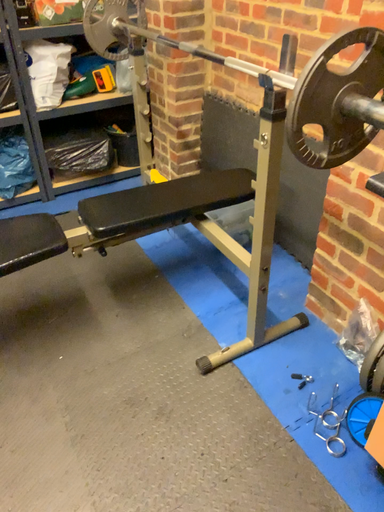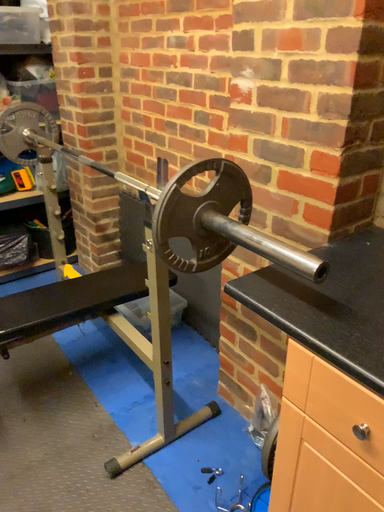
Question: How did the camera likely rotate when shooting the video?

Choices:
 (A) rotated left
 (B) rotated right

Answer: (B)